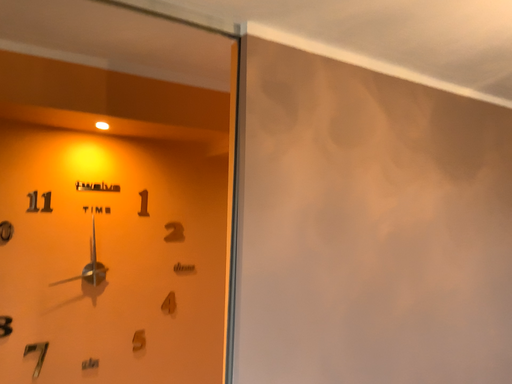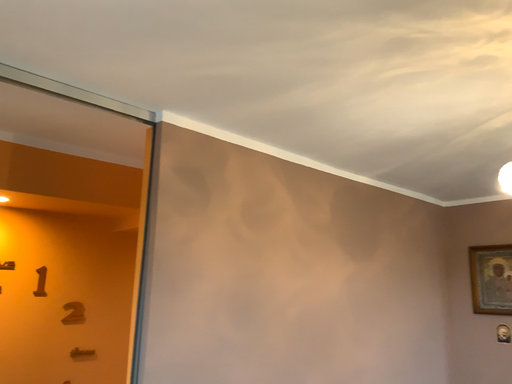
Question: How did the camera likely rotate when shooting the video?

Choices:
 (A) rotated downward
 (B) rotated upward

Answer: (B)